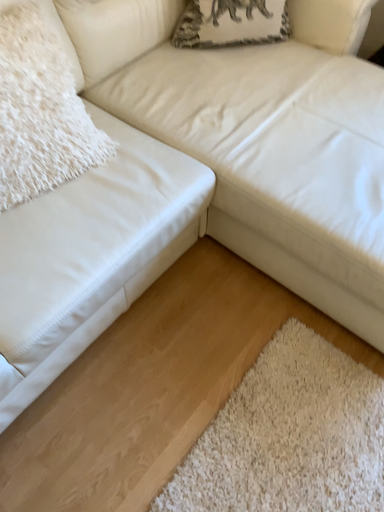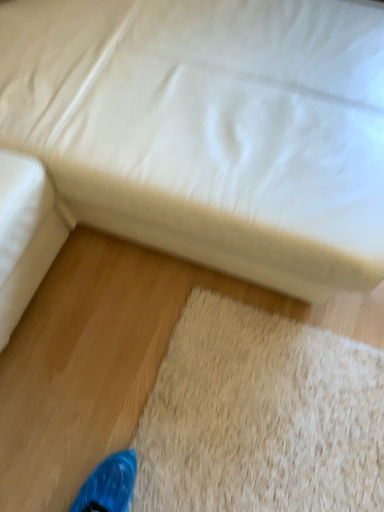
Question: Which way did the camera rotate in the video?

Choices:
 (A) rotated downward
 (B) rotated upward

Answer: (A)